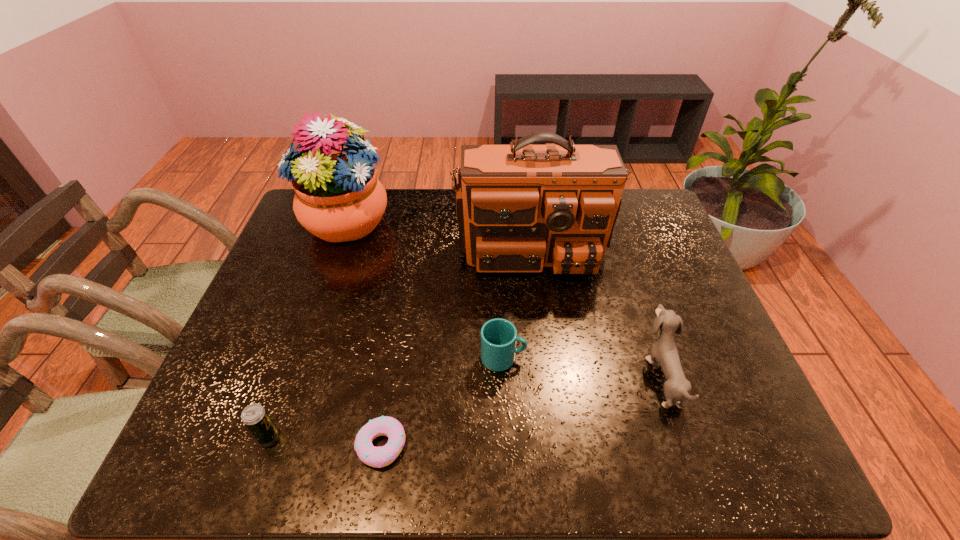
In order to click on unoccupied area between the doughnut and the beer can in this screenshot , I will do `click(324, 441)`.

Find the location of `free area in between the beer can and the doughnut`. free area in between the beer can and the doughnut is located at coordinates 324,441.

Image resolution: width=960 pixels, height=540 pixels. Find the location of `vacant point located between the beer can and the satchel`. vacant point located between the beer can and the satchel is located at coordinates (398, 333).

Find the location of `empty space between the cup and the flower arrangement`. empty space between the cup and the flower arrangement is located at coordinates (425, 290).

Where is `free spot between the puppy and the flower arrangement`? free spot between the puppy and the flower arrangement is located at coordinates (504, 299).

Identify the location of free area in between the puppy and the satchel. (595, 303).

What are the coordinates of `free point between the cup and the satchel` in the screenshot? It's located at (516, 294).

Where is `free spot between the cup and the fourth object from right to left`? free spot between the cup and the fourth object from right to left is located at coordinates (443, 402).

Find the location of a particular element. Image resolution: width=960 pixels, height=540 pixels. the second closest object to the beer can is located at coordinates (499, 336).

This screenshot has width=960, height=540. Find the location of `object that can be found as the second closest to the shortest object`. object that can be found as the second closest to the shortest object is located at coordinates (499, 336).